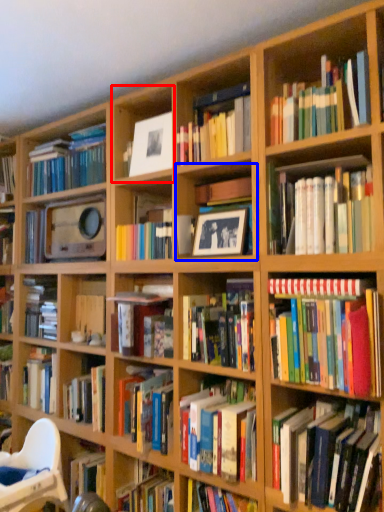
Question: Which object is further to the camera taking this photo, shelf (highlighted by a red box) or cabinet (highlighted by a blue box)?

Choices:
 (A) shelf
 (B) cabinet

Answer: (A)